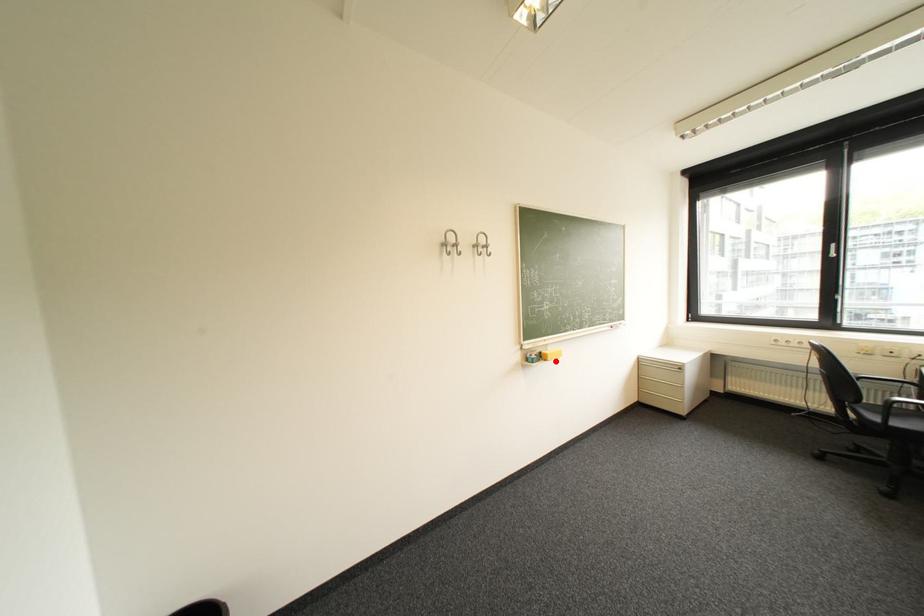
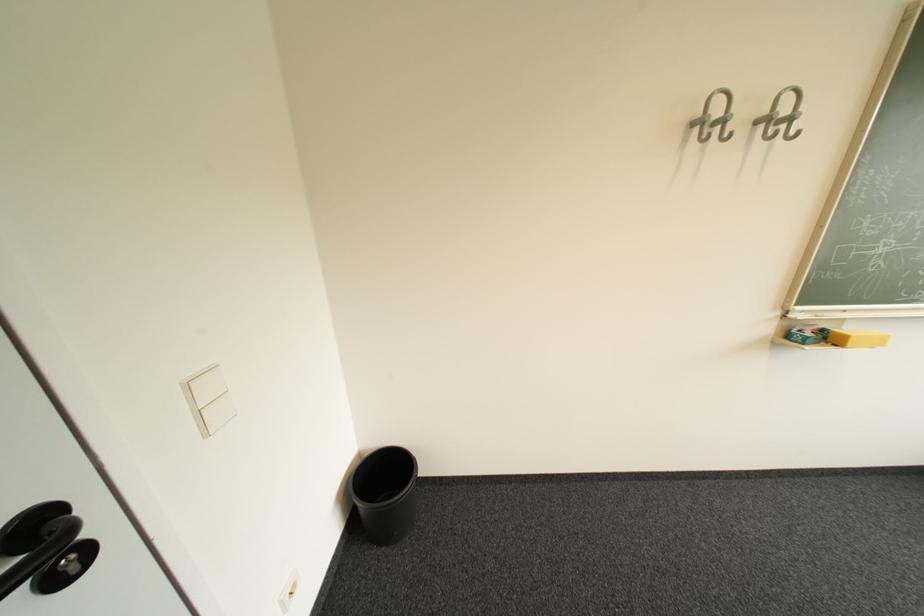
Where in the second image is the point corresponding to the highlighted location from the first image?

(846, 346)